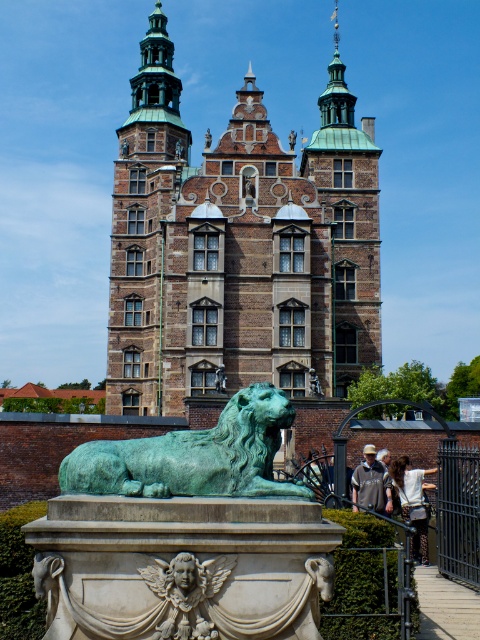
Question: Estimate the real-world distances between objects in this image. Which object is closer to the gray fabric jacket at lower center?

Choices:
 (A) white cotton shirt at lower right
 (B) green stone tower at center

Answer: (A)

Question: Does green stone tower at center have a smaller size compared to gray fabric jacket at lower center?

Choices:
 (A) no
 (B) yes

Answer: (A)

Question: Estimate the real-world distances between objects in this image. Which object is closer to the carved stone cherub at center?

Choices:
 (A) green patina bronze lion at center
 (B) green stone tower at center

Answer: (A)

Question: Which object is the closest to the gray fabric jacket at lower center?

Choices:
 (A) green patina stone lion at center
 (B) light brown hair at lower right
 (C) green patina lion at center
 (D) carved stone cherub at center

Answer: (B)

Question: Can you confirm if white cotton shirt at lower right is positioned below green patina stone lion at center?

Choices:
 (A) yes
 (B) no

Answer: (A)

Question: Does white cotton shirt at lower right appear over green patina lion at center?

Choices:
 (A) no
 (B) yes

Answer: (A)